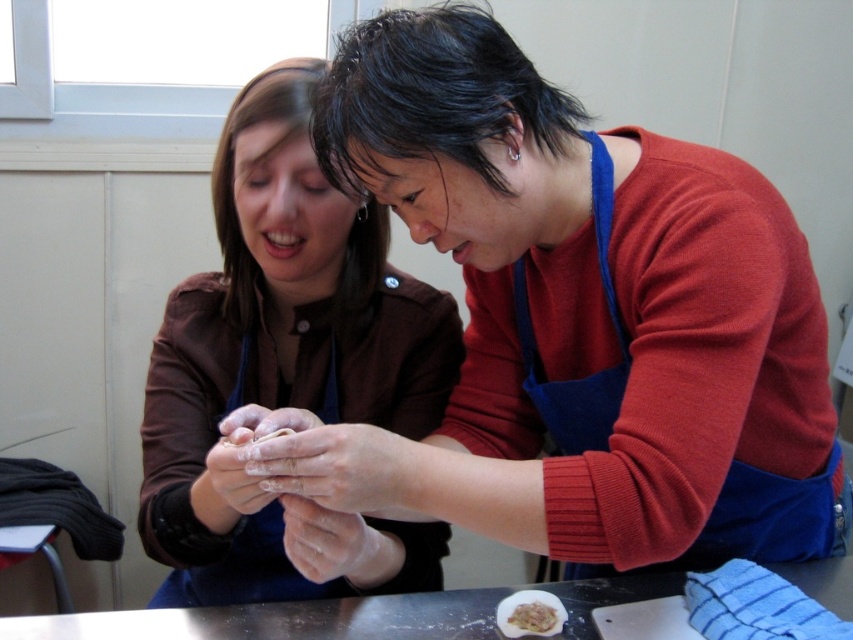
You are a chef observing a kitchen scene where two people are preparing dough. You notice a white floury hand at center and a white fluffy dough at lower center. Which object is wider?

The white floury hand at center might be wider than white fluffy dough at lower center according to the description.

You are a chef trying to wash your hands in the kitchen. You see two white floury hands at center and a white floury hand at center. Which one should you wash first?

The white floury hands at center should be washed first since they are in front of the white floury hand at center, indicating they are more accessible.

You are a chef observing two people in a kitchen preparing food. You notice a point marked at coordinates (331, 465). Based on the scene, what is located at this point?

The point at coordinates (331, 465) marks white floury hands at center.